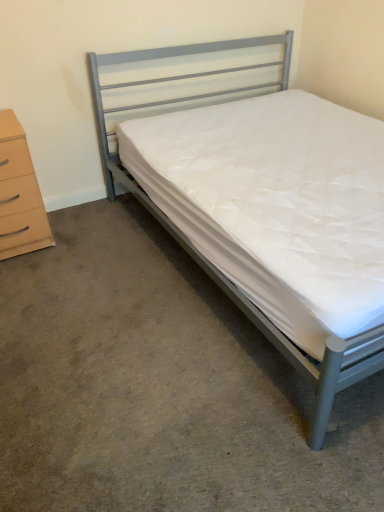
Question: Does metallic gray bed at center have a smaller size compared to white quilted mattress at center?

Choices:
 (A) yes
 (B) no

Answer: (B)

Question: Considering the relative positions of metallic gray bed at center and white quilted mattress at center in the image provided, is metallic gray bed at center to the right of white quilted mattress at center from the viewer's perspective?

Choices:
 (A) no
 (B) yes

Answer: (B)

Question: Is metallic gray bed at center wider than white quilted mattress at center?

Choices:
 (A) yes
 (B) no

Answer: (A)

Question: Is metallic gray bed at center oriented away from white quilted mattress at center?

Choices:
 (A) no
 (B) yes

Answer: (A)

Question: Is metallic gray bed at center in front of white quilted mattress at center?

Choices:
 (A) no
 (B) yes

Answer: (B)

Question: Is white quilted mattress at center completely or partially inside metallic gray bed at center?

Choices:
 (A) yes
 (B) no

Answer: (B)

Question: Considering the relative positions of white quilted mattress at center and beige wood chest of drawers at left in the image provided, is white quilted mattress at center to the right of beige wood chest of drawers at left from the viewer's perspective?

Choices:
 (A) no
 (B) yes

Answer: (B)

Question: Is white quilted mattress at center not near beige wood chest of drawers at left?

Choices:
 (A) yes
 (B) no

Answer: (B)

Question: Could you tell me if white quilted mattress at center is turned towards beige wood chest of drawers at left?

Choices:
 (A) yes
 (B) no

Answer: (B)

Question: Does white quilted mattress at center lie in front of beige wood chest of drawers at left?

Choices:
 (A) yes
 (B) no

Answer: (A)

Question: Is white quilted mattress at center bigger than beige wood chest of drawers at left?

Choices:
 (A) no
 (B) yes

Answer: (B)

Question: Does white quilted mattress at center have a greater width compared to beige wood chest of drawers at left?

Choices:
 (A) no
 (B) yes

Answer: (B)

Question: Considering the relative positions of metallic gray bed at center and beige wood chest of drawers at left in the image provided, is metallic gray bed at center in front of beige wood chest of drawers at left?

Choices:
 (A) yes
 (B) no

Answer: (A)